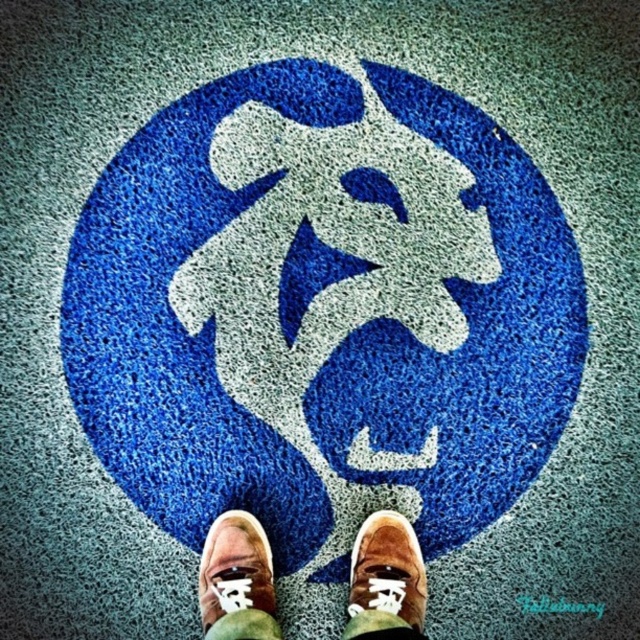
You are standing in front of the circular design on the ground and notice two brown suede shoes. The shoes are positioned at center and lower center. How far apart are the brown suede shoes at center and the brown suede shoe at lower center?

The brown suede shoes at center is 6.30 centimeters from brown suede shoe at lower center.

Consider the image. You are standing in front of the blue textured carpet at center and the suede brown shoe at center. Which object is positioned to the right side?

The blue textured carpet at center is to the right of the suede brown shoe at center, so the blue textured carpet at center is positioned to the right side.